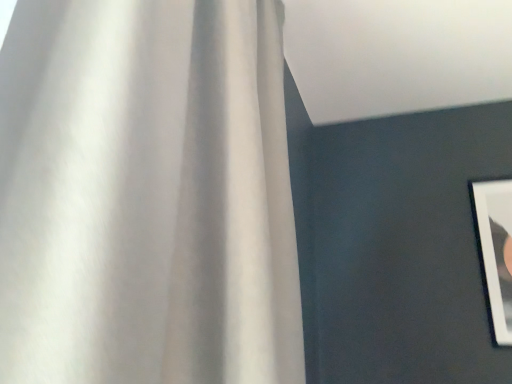
Question: In terms of size, does white glossy picture frame at right appear bigger or smaller than white matte curtain at upper left?

Choices:
 (A) big
 (B) small

Answer: (B)

Question: Is point (485, 236) closer or farther from the camera than point (119, 31)?

Choices:
 (A) closer
 (B) farther

Answer: (B)

Question: Considering their positions, is white glossy picture frame at right located in front of or behind white matte curtain at upper left?

Choices:
 (A) front
 (B) behind

Answer: (B)

Question: Is white matte curtain at upper left wider or thinner than white glossy picture frame at right?

Choices:
 (A) wide
 (B) thin

Answer: (A)

Question: Choose the correct answer: Is white matte curtain at upper left inside white glossy picture frame at right or outside it?

Choices:
 (A) outside
 (B) inside

Answer: (A)

Question: From a real-world perspective, is white matte curtain at upper left positioned above or below white glossy picture frame at right?

Choices:
 (A) below
 (B) above

Answer: (B)

Question: Visually, is white matte curtain at upper left positioned to the left or to the right of white glossy picture frame at right?

Choices:
 (A) right
 (B) left

Answer: (B)